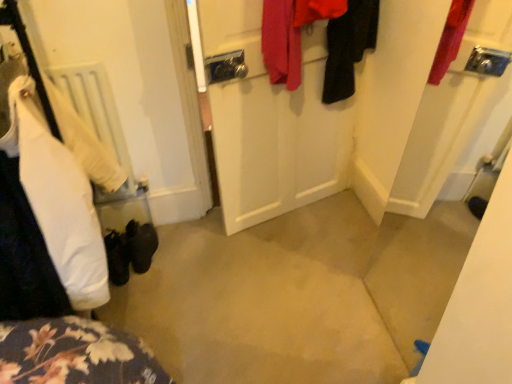
Question: From the image's perspective, is black fabric coat at upper right, the third clothing viewed from the left, positioned above or below white matte radiator at left?

Choices:
 (A) below
 (B) above

Answer: (B)

Question: Is point (373, 11) closer or farther from the camera than point (108, 150)?

Choices:
 (A) farther
 (B) closer

Answer: (B)

Question: Considering the real-world distances, which object is farthest from the red fabric coat at upper center, which ranks as the second clothing in right-to-left order?

Choices:
 (A) white matte door at center
 (B) black suede shoes at lower left
 (C) white cotton shirt at left, the 1th clothing viewed from the left
 (D) black fabric coat at upper right, the third clothing viewed from the left
 (E) white matte radiator at left

Answer: (B)

Question: Considering the real-world distances, which object is closest to the black suede shoes at lower left?

Choices:
 (A) white matte door at center
 (B) white cotton shirt at left, the 1th clothing viewed from the left
 (C) red fabric coat at upper center, arranged as the 2th clothing when viewed from the left
 (D) black fabric coat at upper right, which ranks as the 1th clothing in right-to-left order
 (E) white matte radiator at left

Answer: (E)